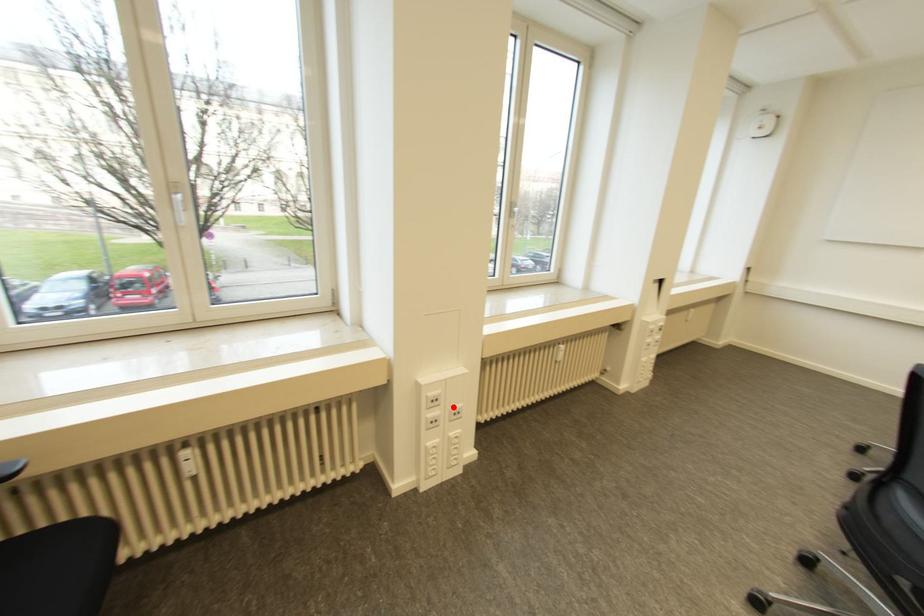
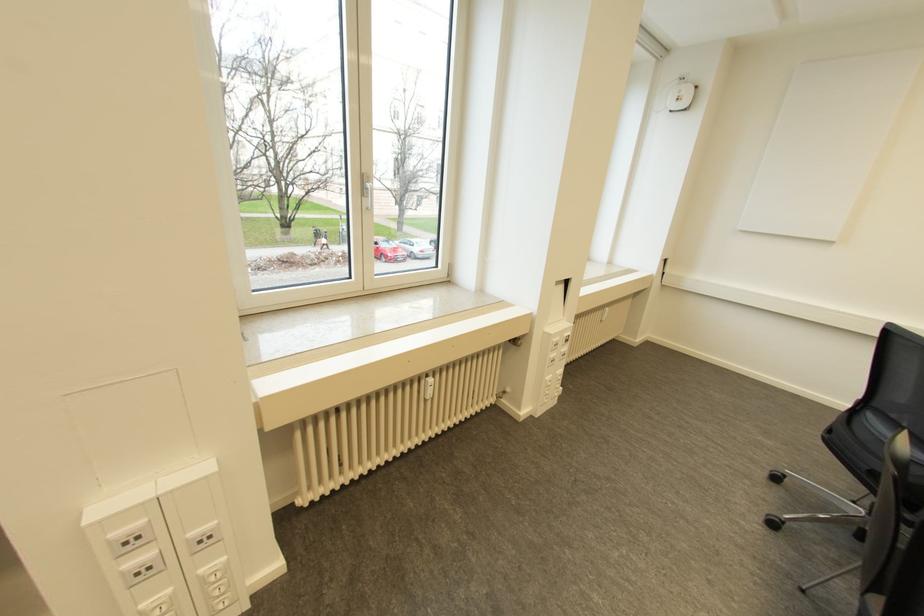
Question: I am providing you with two images of the same scene from different viewpoints. In image1, a red point is highlighted. Considering the same 3D point in image2, which of the following is correct?

Choices:
 (A) It is closer
 (B) It is farther

Answer: (A)